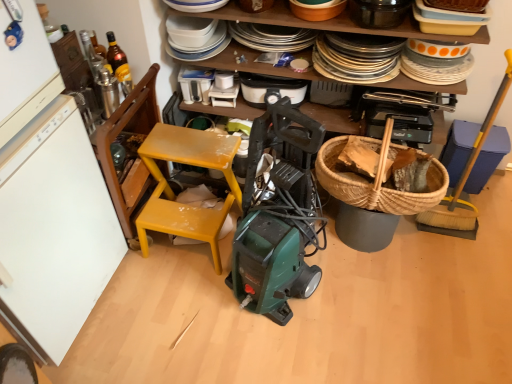
Question: Is point (210, 79) positioned closer to the camera than point (111, 112)?

Choices:
 (A) closer
 (B) farther

Answer: (B)

Question: From their relative heights in the image, would you say white plastic container at upper center, the 6th appliance viewed from the right, is taller or shorter than metallic silver thermos at upper left, the seventh appliance in the right-to-left sequence?

Choices:
 (A) tall
 (B) short

Answer: (B)

Question: Estimate the real-world distances between objects in this image. Which object is closer to the wooden plate rack at upper center, placed as the second shelf when sorted from front to back?

Choices:
 (A) white matte refrigerator at left
 (B) white plastic toaster at upper center, the fifth appliance from the right
 (C) black plastic vacuum cleaner at center, placed as the fourth appliance when sorted from left to right
 (D) yellow plastic broom at right, which is the sixth appliance from left to right
 (E) blue plastic trash can at right, which is counted as the first appliance, starting from the right

Answer: (C)

Question: Estimate the real-world distances between objects in this image. Which object is closer to the wooden plate rack at upper center, the first shelf viewed from the back?

Choices:
 (A) yellow matte chair at center
 (B) white plastic toaster at upper center, the third appliance when ordered from left to right
 (C) yellow plastic broom at right, which is counted as the 2th appliance, starting from the right
 (D) white plastic container at upper center, which appears as the second appliance when viewed from the left
 (E) stainless steel pot at upper center, the 5th appliance viewed from the left

Answer: (E)